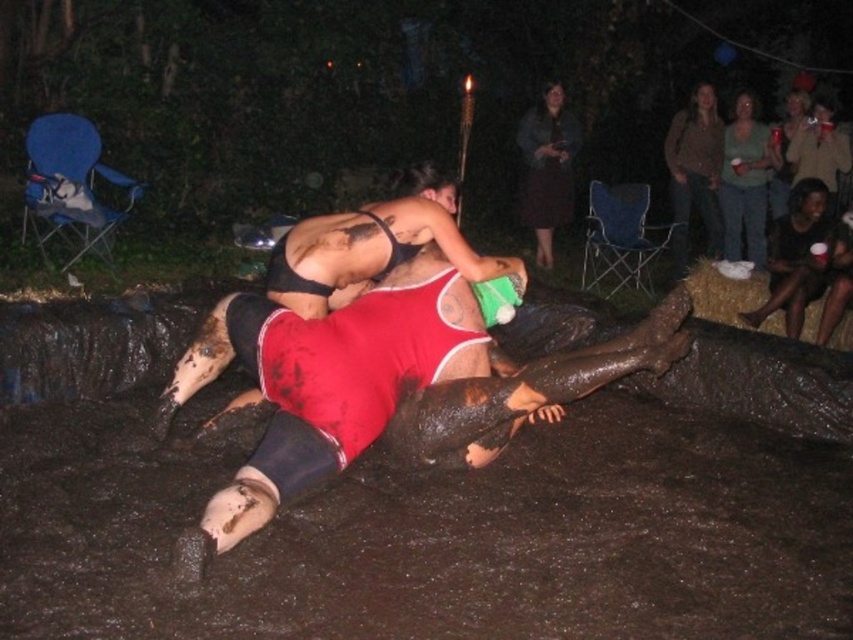
Is point (461, 352) positioned in front of point (296, 252)?

Yes, point (461, 352) is closer to viewer.

Describe the element at coordinates (273, 435) in the screenshot. I see `red fabric tank top at center` at that location.

Measure the distance between point (x=525, y=396) and camera.

Point (x=525, y=396) is 3.82 meters from camera.

What are the coordinates of `red fabric tank top at center` in the screenshot? It's located at (273, 435).

Who is higher up, brown textured sweater at upper right or green matte shirt at upper right?

green matte shirt at upper right is above.

Is brown textured sweater at upper right to the left of green matte shirt at upper right from the viewer's perspective?

Indeed, brown textured sweater at upper right is positioned on the left side of green matte shirt at upper right.

I want to click on brown textured sweater at upper right, so click(x=694, y=172).

The width and height of the screenshot is (853, 640). Find the location of `brown textured sweater at upper right`. brown textured sweater at upper right is located at coordinates (694, 172).

Is red fabric tank top at center shorter than dark brown fabric dress at upper center?

Indeed, red fabric tank top at center has a lesser height compared to dark brown fabric dress at upper center.

Is red fabric tank top at center wider than dark brown fabric dress at upper center?

Yes.

Between point (260, 513) and point (543, 128), which one is positioned behind?

The point (543, 128) is behind.

Identify the location of red fabric tank top at center. This screenshot has width=853, height=640. (273, 435).